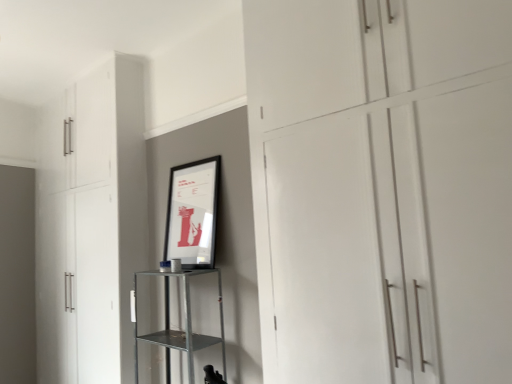
Question: From a real-world perspective, is white matte cupboard at center, which appears as the 2th cupboard when viewed from the back, above or below matte black picture frame at center?

Choices:
 (A) above
 (B) below

Answer: (A)

Question: Looking at the image, does white matte cupboard at center, which appears as the 2th cupboard when viewed from the back, seem bigger or smaller compared to matte black picture frame at center?

Choices:
 (A) big
 (B) small

Answer: (A)

Question: Based on their relative distances, which object is nearer to the white matte cupboard at center, which appears as the 2th cupboard when viewed from the back?

Choices:
 (A) white matte cabinet at left, the first cupboard when ordered from back to front
 (B) metallic silver shelf at center
 (C) matte black picture frame at center

Answer: (C)

Question: Estimate the real-world distances between objects in this image. Which object is closer to the matte black picture frame at center?

Choices:
 (A) white matte cupboard at center, which is the 2th cupboard from left to right
 (B) white matte cabinet at left, the first cupboard when ordered from back to front
 (C) metallic silver shelf at center

Answer: (C)